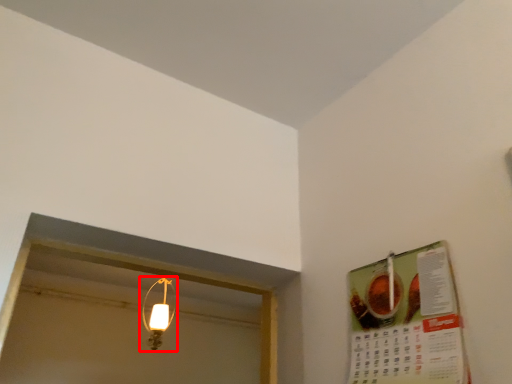
Question: From the image's perspective, what is the correct spatial relationship of lamp (annotated by the red box) in relation to menu?

Choices:
 (A) above
 (B) below

Answer: (B)